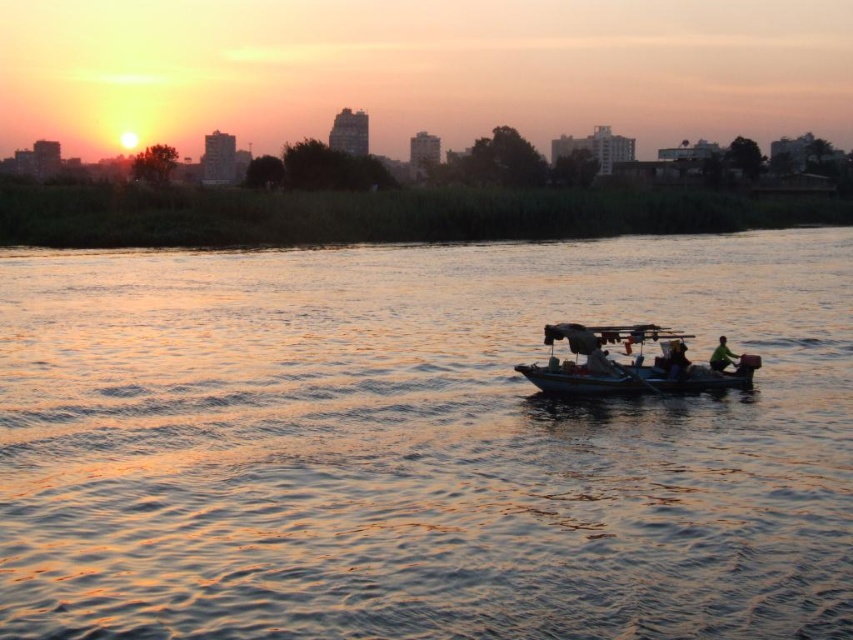
Which is in front, point (421, 586) or point (593, 353)?

Positioned in front is point (421, 586).

Is golden reflective water at center bigger than smooth fabric person at center?

Yes, golden reflective water at center is bigger than smooth fabric person at center.

Where is `golden reflective water at center`? The width and height of the screenshot is (853, 640). golden reflective water at center is located at coordinates (419, 444).

Can you confirm if green fabric boat at center is positioned to the left of green matte jacket at center?

Yes, green fabric boat at center is to the left of green matte jacket at center.

Which is more to the left, green fabric boat at center or green matte jacket at center?

green fabric boat at center is more to the left.

Does point (683, 344) come farther from viewer compared to point (721, 364)?

No, (683, 344) is in front of (721, 364).

I want to click on green fabric boat at center, so click(x=676, y=358).

Is metallic gray boat at center shorter than green fabric boat at center?

No.

Is point (581, 387) closer to camera compared to point (675, 349)?

Yes, it is in front of point (675, 349).

Who is more forward, (647, 323) or (679, 348)?

Positioned in front is point (647, 323).

Where is `metallic gray boat at center`? The width and height of the screenshot is (853, 640). metallic gray boat at center is located at coordinates pos(630,364).